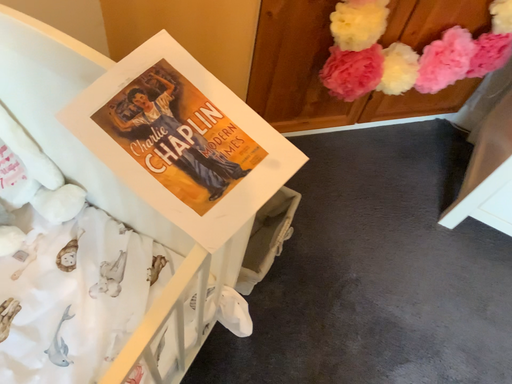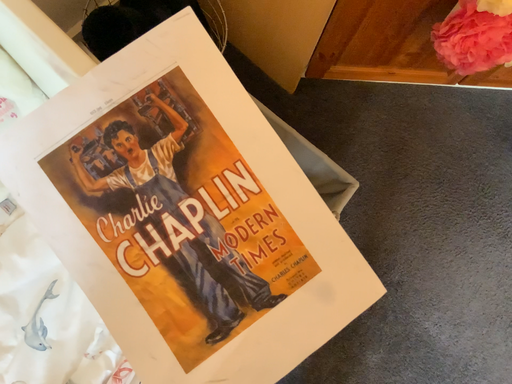
Question: How did the camera likely rotate when shooting the video?

Choices:
 (A) rotated left
 (B) rotated right

Answer: (A)